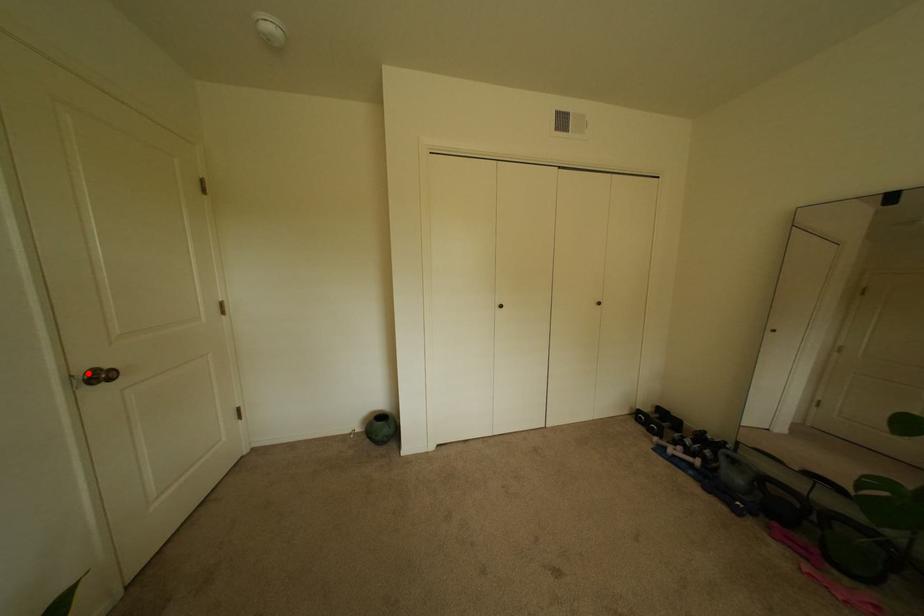
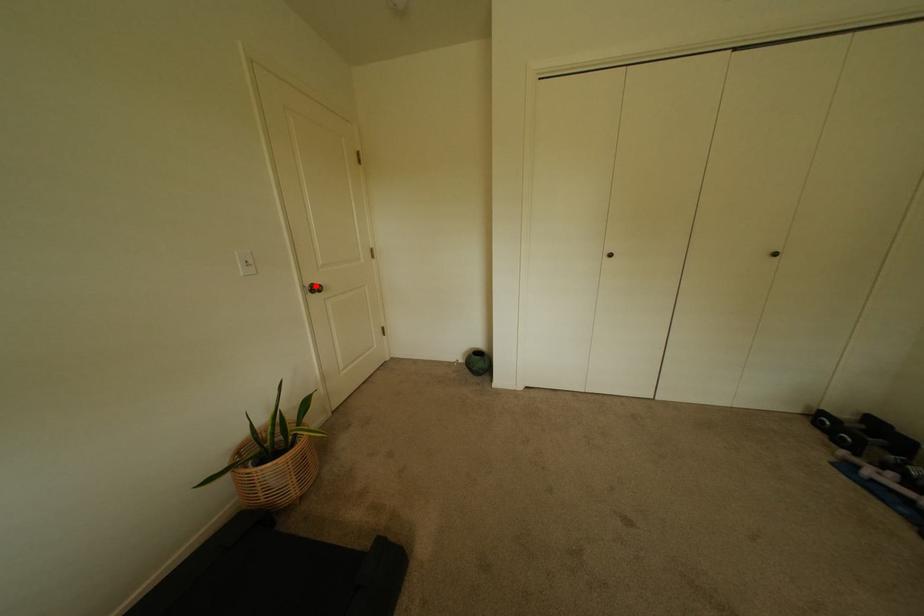
I am providing you with two images of the same scene from different viewpoints. A red point is marked on the first image and another point is marked on the second image. Is the marked point in image1 the same physical position as the marked point in image2?

Yes